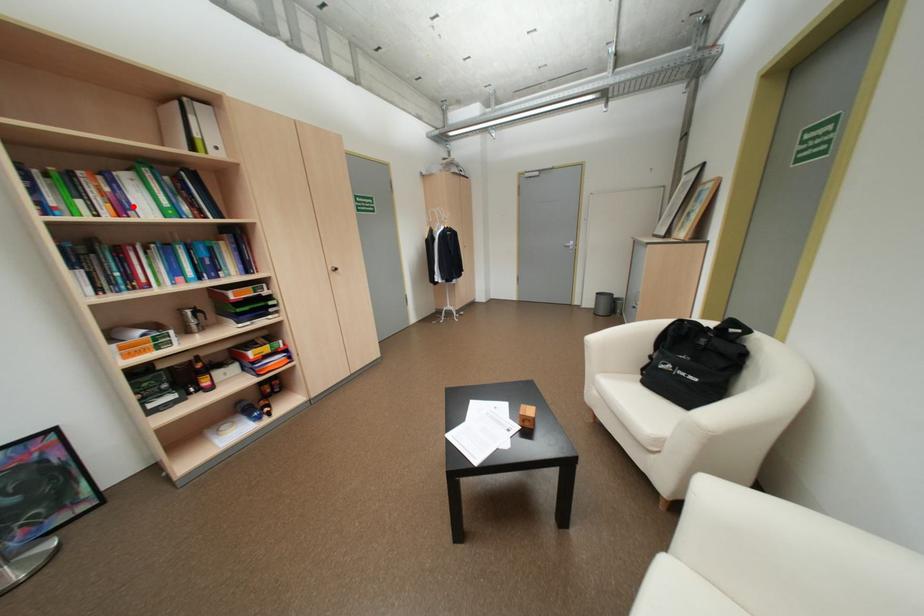
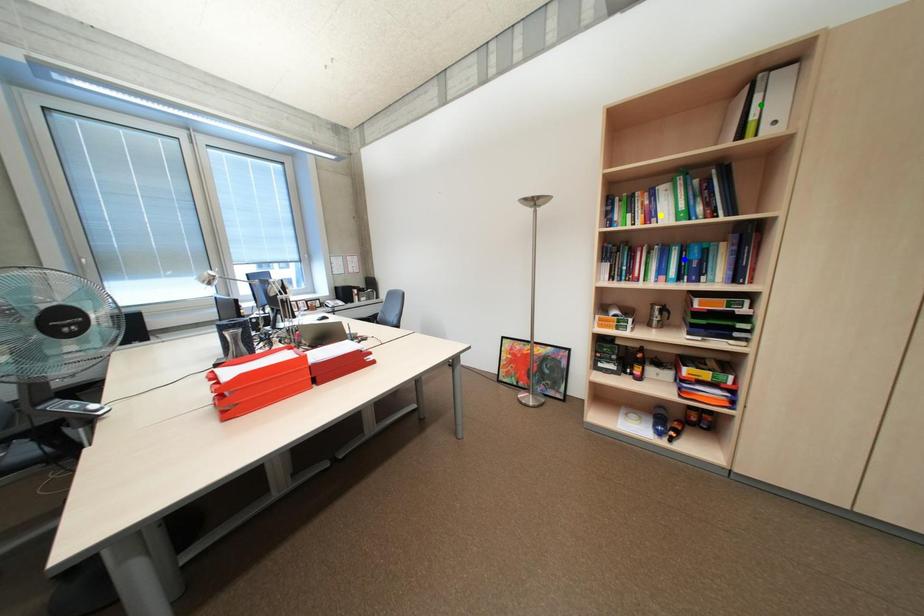
Question: I am providing you with two images of the same scene from different viewpoints. A red point is marked on the first image. You are given multiple points on the second image. Can you choose the point in image 2 that corresponds to the point in image 1?

Choices:
 (A) yellow point
 (B) green point
 (C) blue point

Answer: (A)